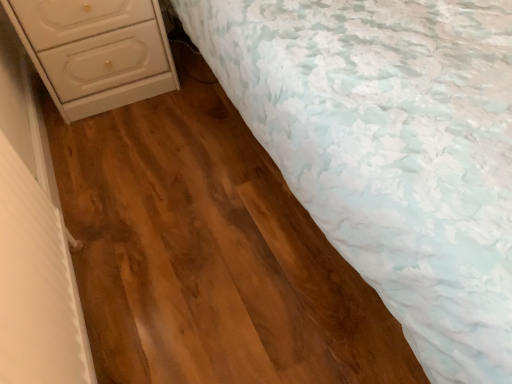
In order to click on white floral fabric at upper right in this screenshot , I will do `click(390, 151)`.

Measure the distance between point (498, 45) and camera.

The distance of point (498, 45) from camera is 35.91 inches.

What do you see at coordinates (390, 151) in the screenshot? I see `white floral fabric at upper right` at bounding box center [390, 151].

What do you see at coordinates (95, 51) in the screenshot? This screenshot has width=512, height=384. I see `white glossy chest of drawers at left` at bounding box center [95, 51].

Locate an element on the screen. The image size is (512, 384). white glossy chest of drawers at left is located at coordinates (95, 51).

Find the location of a particular element. The image size is (512, 384). white floral fabric at upper right is located at coordinates (390, 151).

Between white floral fabric at upper right and white glossy chest of drawers at left, which one appears on the left side from the viewer's perspective?

Positioned to the left is white glossy chest of drawers at left.

Relative to white glossy chest of drawers at left, is white floral fabric at upper right in front or behind?

Clearly, white floral fabric at upper right is in front of white glossy chest of drawers at left.

Which is in front, point (328, 210) or point (53, 38)?

Positioned in front is point (328, 210).

From the image's perspective, is white floral fabric at upper right located above or below white glossy chest of drawers at left?

white floral fabric at upper right is above white glossy chest of drawers at left.

From a real-world perspective, does white floral fabric at upper right stand above white glossy chest of drawers at left?

Yes, from a real-world perspective, white floral fabric at upper right is over white glossy chest of drawers at left

Considering the relative sizes of white floral fabric at upper right and white glossy chest of drawers at left in the image provided, is white floral fabric at upper right thinner than white glossy chest of drawers at left?

No, white floral fabric at upper right is not thinner than white glossy chest of drawers at left.

From their relative heights in the image, would you say white floral fabric at upper right is taller or shorter than white glossy chest of drawers at left?

In the image, white floral fabric at upper right appears to be taller than white glossy chest of drawers at left.

Considering the relative sizes of white floral fabric at upper right and white glossy chest of drawers at left in the image provided, is white floral fabric at upper right bigger than white glossy chest of drawers at left?

Correct, white floral fabric at upper right is larger in size than white glossy chest of drawers at left.

Is white glossy chest of drawers at left a part of white floral fabric at upper right?

Definitely not — white glossy chest of drawers at left is not inside white floral fabric at upper right.

Are white floral fabric at upper right and white glossy chest of drawers at left located far from each other?

No, white floral fabric at upper right is not far away from white glossy chest of drawers at left.

Is white glossy chest of drawers at left at the back of white floral fabric at upper right?

No, white floral fabric at upper right's orientation is not away from white glossy chest of drawers at left.

Locate an element on the screen. bed positioned vertically above the white glossy chest of drawers at left (from a real-world perspective) is located at coordinates (390, 151).

Is white glossy chest of drawers at left to the right of white floral fabric at upper right from the viewer's perspective?

Incorrect, white glossy chest of drawers at left is not on the right side of white floral fabric at upper right.

Is white glossy chest of drawers at left closer to the viewer compared to white floral fabric at upper right?

No, white glossy chest of drawers at left is behind white floral fabric at upper right.

Does point (91, 112) come in front of point (379, 55)?

No, (91, 112) is behind (379, 55).

From the image's perspective, would you say white glossy chest of drawers at left is positioned over white floral fabric at upper right?

No, from the image's perspective, white glossy chest of drawers at left is not above white floral fabric at upper right.

From a real-world perspective, relative to white floral fabric at upper right, is white glossy chest of drawers at left vertically above or below?

Clearly, from a real-world perspective, white glossy chest of drawers at left is below white floral fabric at upper right.

Does white glossy chest of drawers at left have a greater width compared to white floral fabric at upper right?

Incorrect, the width of white glossy chest of drawers at left does not surpass that of white floral fabric at upper right.

Is white glossy chest of drawers at left taller than white floral fabric at upper right?

No, white glossy chest of drawers at left is not taller than white floral fabric at upper right.

Which of these two, white glossy chest of drawers at left or white floral fabric at upper right, is smaller?

Smaller between the two is white glossy chest of drawers at left.

Is white floral fabric at upper right located within white glossy chest of drawers at left?

No, white floral fabric at upper right is not a part of white glossy chest of drawers at left.

Are white glossy chest of drawers at left and white floral fabric at upper right making contact?

white glossy chest of drawers at left and white floral fabric at upper right are clearly separated.

Is white glossy chest of drawers at left oriented away from white floral fabric at upper right?

No, white glossy chest of drawers at left is not facing the opposite direction of white floral fabric at upper right.

How different are the orientations of white glossy chest of drawers at left and white floral fabric at upper right in degrees?

There is a 0.822-degree angle between the facing directions of white glossy chest of drawers at left and white floral fabric at upper right.

How far apart are white glossy chest of drawers at left and white floral fabric at upper right?

white glossy chest of drawers at left and white floral fabric at upper right are 31.90 inches apart.

Where is `bed above the white glossy chest of drawers at left (from the image's perspective)`? This screenshot has width=512, height=384. bed above the white glossy chest of drawers at left (from the image's perspective) is located at coordinates (390, 151).

Locate an element on the screen. bed above the white glossy chest of drawers at left (from the image's perspective) is located at coordinates (390, 151).

Where is `bed above the white glossy chest of drawers at left (from a real-world perspective)`? bed above the white glossy chest of drawers at left (from a real-world perspective) is located at coordinates (390, 151).